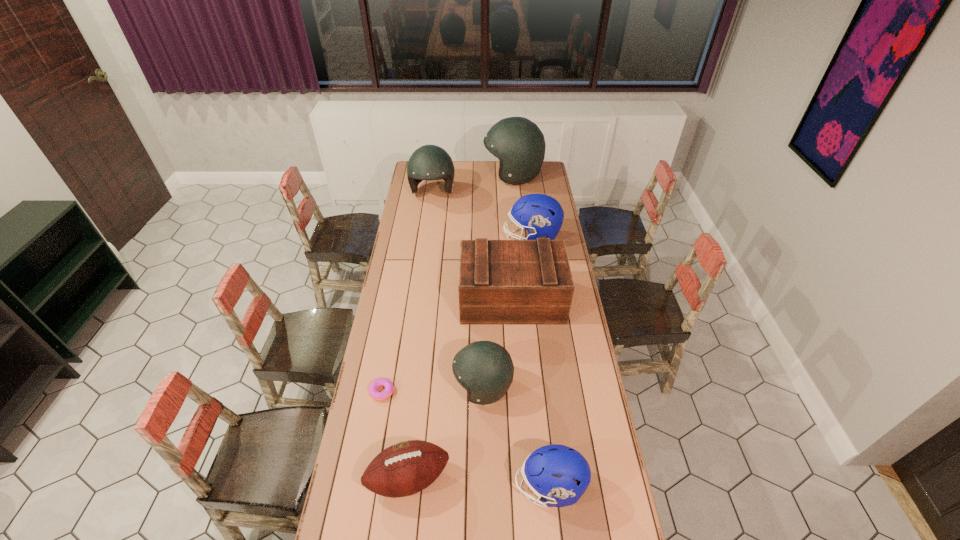
Find the location of a particular element. the smaller blue football helmet is located at coordinates (549, 471).

Image resolution: width=960 pixels, height=540 pixels. I want to click on brown football (American), so click(x=406, y=468).

Locate an element on the screen. the seventh tallest object is located at coordinates (406, 468).

The width and height of the screenshot is (960, 540). Identify the location of doughnut. (389, 387).

You are a GUI agent. You are given a task and a screenshot of the screen. Output one action in this format:
    pyautogui.click(x=<x>, y=<y>)
    Task: Click on the shortest object
    This screenshot has width=960, height=540.
    Given the screenshot: What is the action you would take?
    tap(389, 387)

The height and width of the screenshot is (540, 960). What are the coordinates of `vacant space located at the face opening of the biggest green football helmet` in the screenshot? It's located at (475, 175).

Where is `blank area located at the face opening of the biggest green football helmet`? blank area located at the face opening of the biggest green football helmet is located at coordinates (463, 175).

Where is `free space located at the face opening of the biggest green football helmet`? The height and width of the screenshot is (540, 960). free space located at the face opening of the biggest green football helmet is located at coordinates [x=422, y=175].

At what (x,y) coordinates should I click in order to perform the action: click on free space located 0.360m at the face opening of the leftmost green football helmet. Please return your answer as a coordinate pair (x, y). The height and width of the screenshot is (540, 960). Looking at the image, I should click on (425, 248).

You are a GUI agent. You are given a task and a screenshot of the screen. Output one action in this format:
    pyautogui.click(x=<x>, y=<y>)
    Task: Click on the free space located 0.380m on the front-facing side of the third farthest object
    The height and width of the screenshot is (540, 960).
    Given the screenshot: What is the action you would take?
    pyautogui.click(x=430, y=238)